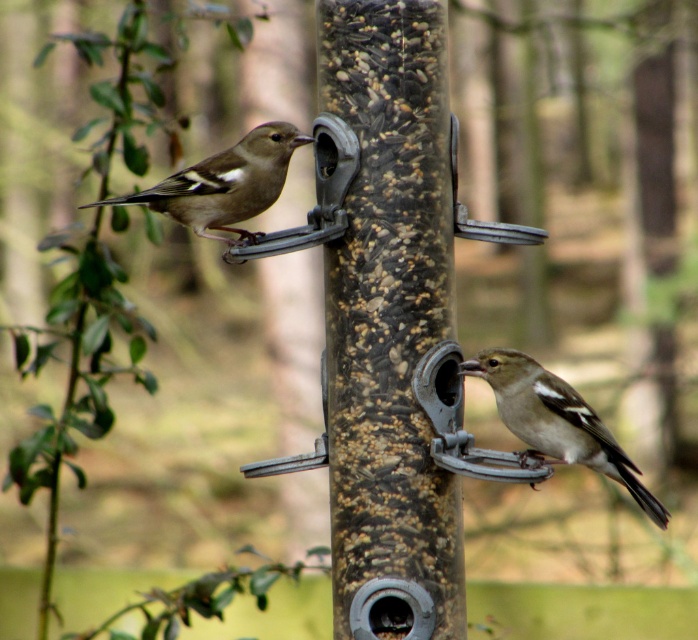
Question: Does brown speckled sparrow at lower right have a larger size compared to brown speckled feathers at upper left?

Choices:
 (A) yes
 (B) no

Answer: (B)

Question: Which point is farther to the camera?

Choices:
 (A) brown speckled feathers at upper left
 (B) brown speckled sparrow at lower right

Answer: (A)

Question: Is brown speckled sparrow at lower right to the right of brown speckled feathers at upper left from the viewer's perspective?

Choices:
 (A) yes
 (B) no

Answer: (A)

Question: Which of the following is the farthest from the observer?

Choices:
 (A) (274, 168)
 (B) (601, 442)

Answer: (A)

Question: Can you confirm if brown speckled sparrow at lower right is positioned above brown speckled feathers at upper left?

Choices:
 (A) no
 (B) yes

Answer: (A)